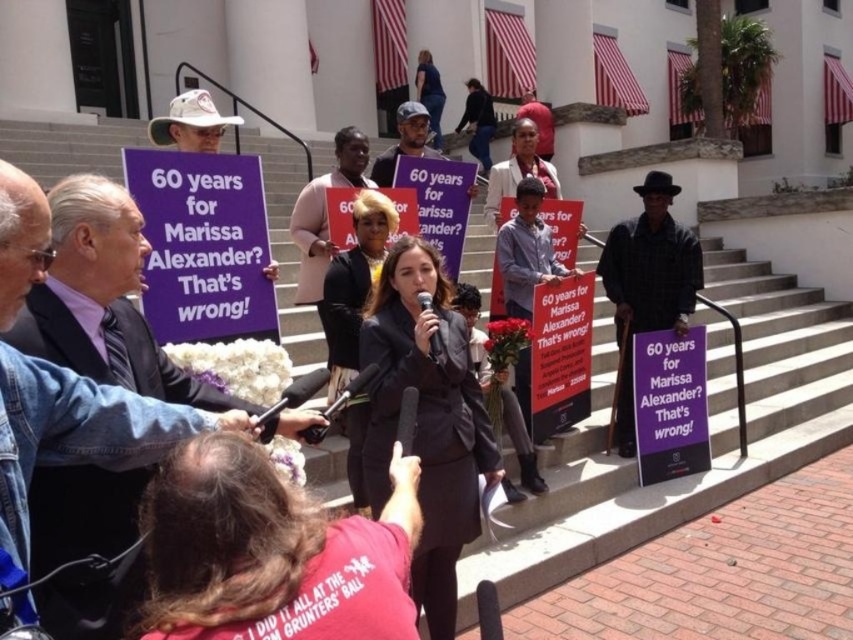
Is dark suit at center taller than black hat at center?

Incorrect, dark suit at center's height is not larger of black hat at center's.

The image size is (853, 640). What do you see at coordinates (103, 300) in the screenshot? I see `dark suit at center` at bounding box center [103, 300].

The width and height of the screenshot is (853, 640). What do you see at coordinates (103, 300) in the screenshot? I see `dark suit at center` at bounding box center [103, 300].

Where is `dark suit at center`? dark suit at center is located at coordinates (103, 300).